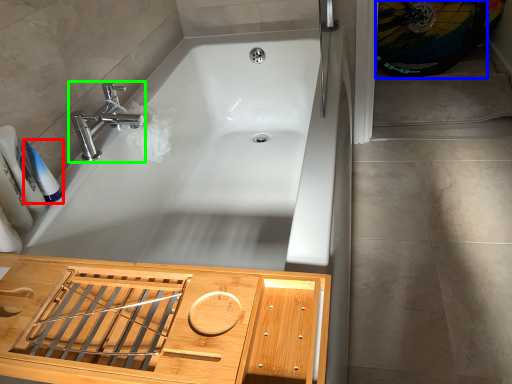
Question: Which is nearer to the toiletry (highlighted by a red box)? bicycle wheel (highlighted by a blue box) or tap (highlighted by a green box).

Choices:
 (A) bicycle wheel
 (B) tap

Answer: (B)